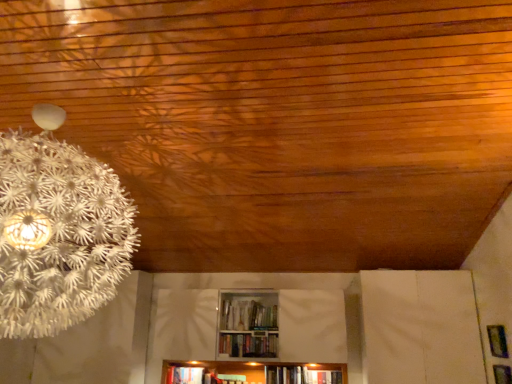
Question: Is hardcover book at lower center, the 1th book when ordered from left to right, facing towards metallic silver frame at lower right?

Choices:
 (A) no
 (B) yes

Answer: (A)

Question: Is hardcover book at lower center, the 1th book from the back, bigger than metallic silver frame at lower right?

Choices:
 (A) no
 (B) yes

Answer: (B)

Question: Is hardcover book at lower center, marked as the 2th book in a front-to-back arrangement, positioned behind metallic silver frame at lower right?

Choices:
 (A) yes
 (B) no

Answer: (A)

Question: Is hardcover book at lower center, marked as the 2th book in a front-to-back arrangement, looking in the opposite direction of metallic silver frame at lower right?

Choices:
 (A) yes
 (B) no

Answer: (B)

Question: Can you confirm if hardcover book at lower center, which is the second book in top-to-bottom order, is smaller than metallic silver frame at lower right?

Choices:
 (A) yes
 (B) no

Answer: (B)

Question: Is hardcover book at center, the second book positioned from the left, wider or thinner than hardcover book at lower center, placed as the 1th book when sorted from bottom to top?

Choices:
 (A) wide
 (B) thin

Answer: (B)

Question: Is point (241, 349) closer or farther from the camera than point (177, 370)?

Choices:
 (A) farther
 (B) closer

Answer: (B)

Question: Considering their positions, is hardcover book at center, positioned as the 1th book in front-to-back order, located in front of or behind hardcover book at lower center, the 1th book when ordered from left to right?

Choices:
 (A) front
 (B) behind

Answer: (A)

Question: Considering the positions of hardcover book at center, arranged as the 2th book when ordered from the bottom, and hardcover book at lower center, which is the second book in top-to-bottom order, in the image, is hardcover book at center, arranged as the 2th book when ordered from the bottom, bigger or smaller than hardcover book at lower center, which is the second book in top-to-bottom order,?

Choices:
 (A) small
 (B) big

Answer: (A)

Question: From a real-world perspective, is metallic silver frame at lower right above or below hardcover book at lower center, placed as the 1th book when sorted from bottom to top?

Choices:
 (A) below
 (B) above

Answer: (B)

Question: Looking at their shapes, would you say metallic silver frame at lower right is wider or thinner than hardcover book at lower center, marked as the 2th book in a front-to-back arrangement?

Choices:
 (A) wide
 (B) thin

Answer: (B)

Question: Considering the positions of metallic silver frame at lower right and hardcover book at lower center, which is the second book in top-to-bottom order, in the image, is metallic silver frame at lower right taller or shorter than hardcover book at lower center, which is the second book in top-to-bottom order,?

Choices:
 (A) short
 (B) tall

Answer: (B)

Question: Is metallic silver frame at lower right bigger or smaller than hardcover book at lower center, the second book from the right?

Choices:
 (A) small
 (B) big

Answer: (A)

Question: Considering the positions of point (266, 336) and point (503, 349), is point (266, 336) closer or farther from the camera than point (503, 349)?

Choices:
 (A) farther
 (B) closer

Answer: (A)

Question: From the image's perspective, relative to metallic silver frame at lower right, is hardcover book at center, positioned as the second book in back-to-front order, above or below?

Choices:
 (A) below
 (B) above

Answer: (A)